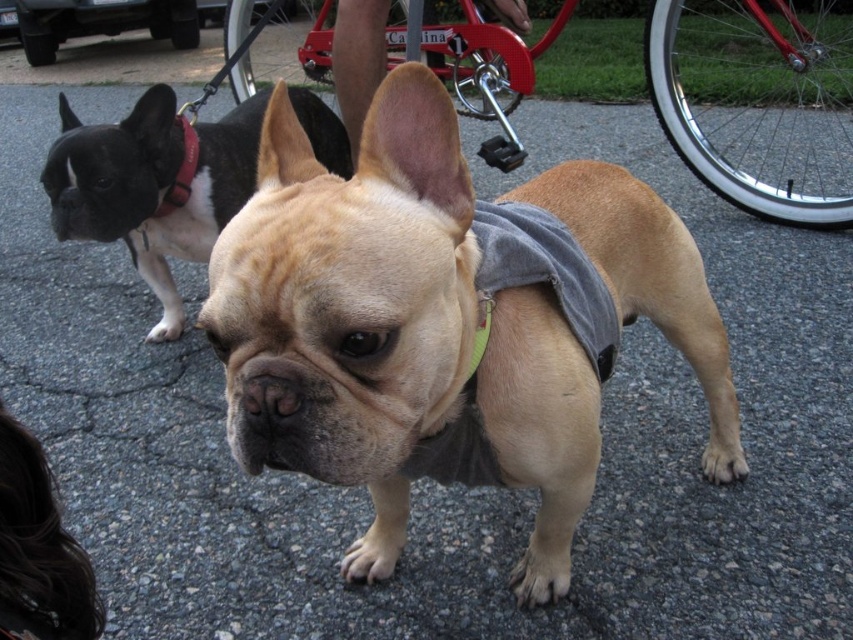
Can you confirm if matte tan french bulldog at center is positioned to the right of black fur dog at left?

Yes, matte tan french bulldog at center is to the right of black fur dog at left.

Is matte tan french bulldog at center above black fur dog at left?

Incorrect, matte tan french bulldog at center is not positioned above black fur dog at left.

Is point (579, 420) positioned in front of point (51, 205)?

Yes.

This screenshot has width=853, height=640. What are the coordinates of `matte tan french bulldog at center` in the screenshot? It's located at (445, 321).

Between point (728, 404) and point (170, 209), which one is positioned in front?

Point (728, 404) is more forward.

Measure the distance from matte tan french bulldog at center to red leather collar at upper left.

The distance of matte tan french bulldog at center from red leather collar at upper left is 1.38 meters.

Describe the element at coordinates (445, 321) in the screenshot. I see `matte tan french bulldog at center` at that location.

Locate an element on the screen. matte tan french bulldog at center is located at coordinates (445, 321).

Consider the image. Can you confirm if black fur dog at left is positioned above red leather collar at upper left?

Actually, black fur dog at left is below red leather collar at upper left.

The width and height of the screenshot is (853, 640). Identify the location of black fur dog at left. (152, 186).

Measure the distance between point (236, 193) and camera.

Point (236, 193) is 2.30 meters from camera.

The width and height of the screenshot is (853, 640). I want to click on black fur dog at left, so click(x=152, y=186).